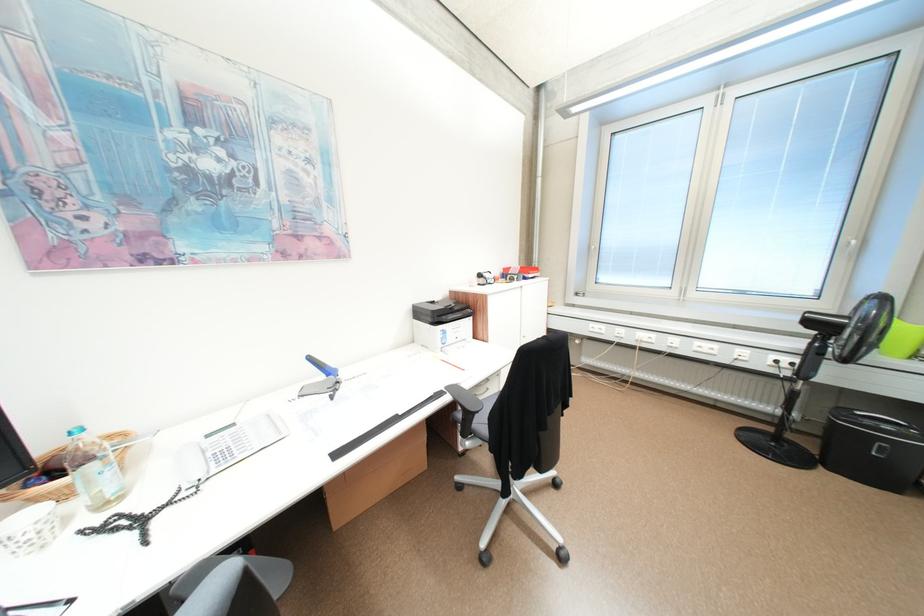
Describe the element at coordinates (484, 408) in the screenshot. I see `a black chair sitting surface` at that location.